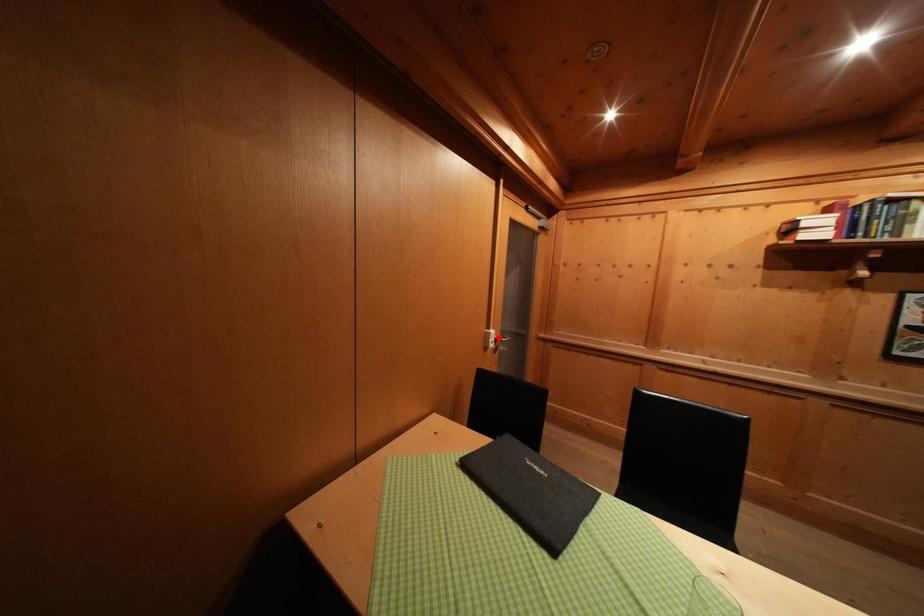
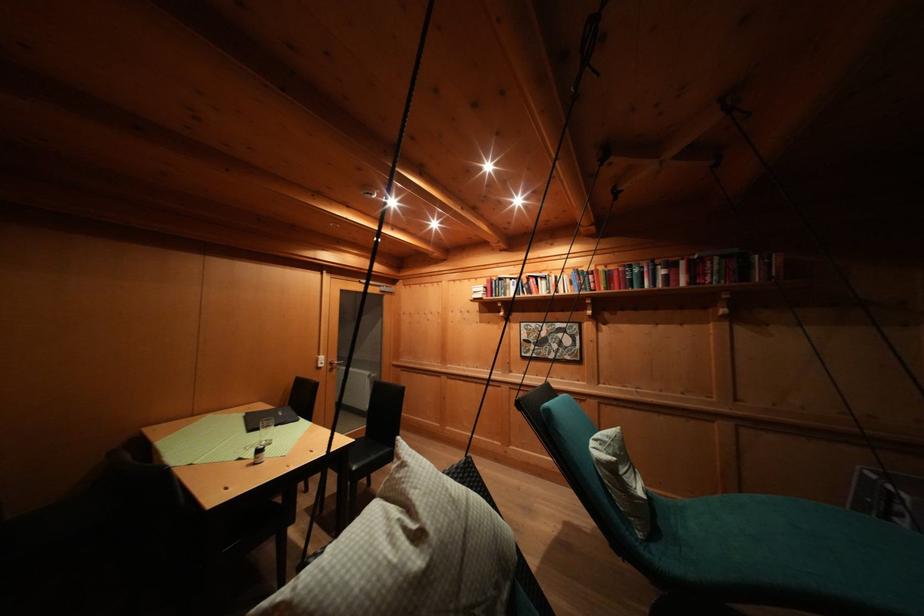
Find the pixel in the second image that matches the highlighted location in the first image.

(327, 362)